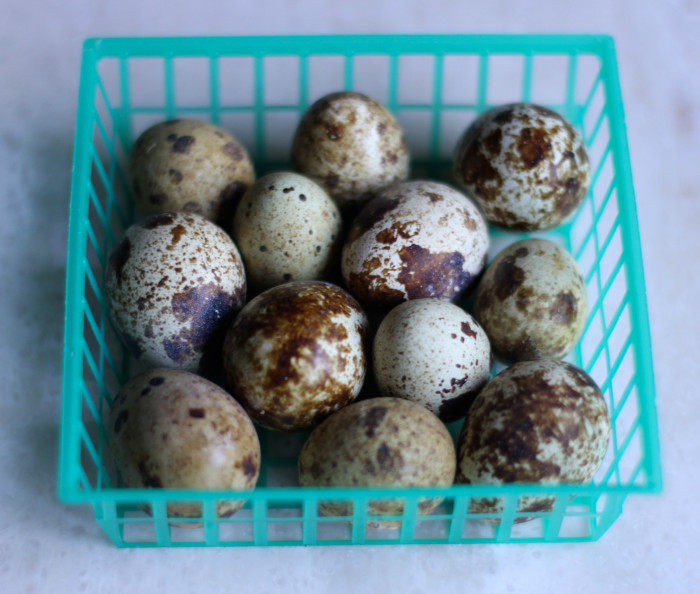
This screenshot has width=700, height=594. Identify the location of bottom left corner of basket. point(76,495).